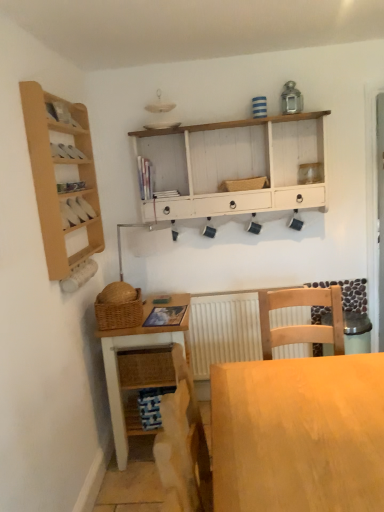
Question: Is wooden cabinet at left outside of light wood desk at center?

Choices:
 (A) no
 (B) yes

Answer: (B)

Question: Is wooden cabinet at left smaller than light wood desk at center?

Choices:
 (A) no
 (B) yes

Answer: (B)

Question: From a real-world perspective, is wooden cabinet at left positioned under light wood desk at center based on gravity?

Choices:
 (A) yes
 (B) no

Answer: (B)

Question: Considering the relative positions of wooden cabinet at left and light wood desk at center in the image provided, is wooden cabinet at left behind light wood desk at center?

Choices:
 (A) no
 (B) yes

Answer: (B)

Question: Does wooden cabinet at left have a lesser height compared to light wood desk at center?

Choices:
 (A) yes
 (B) no

Answer: (A)

Question: Is wooden cabinet at left in contact with light wood desk at center?

Choices:
 (A) no
 (B) yes

Answer: (A)

Question: From a real-world perspective, is light wood desk at center positioned over wooden cabinet at left based on gravity?

Choices:
 (A) no
 (B) yes

Answer: (A)

Question: Is light wood desk at center not inside wooden cabinet at left?

Choices:
 (A) no
 (B) yes

Answer: (B)

Question: Is light wood desk at center not near wooden cabinet at left?

Choices:
 (A) yes
 (B) no

Answer: (A)

Question: From a real-world perspective, is light wood desk at center beneath wooden cabinet at left?

Choices:
 (A) yes
 (B) no

Answer: (A)

Question: Considering the relative sizes of light wood desk at center and wooden cabinet at left in the image provided, is light wood desk at center thinner than wooden cabinet at left?

Choices:
 (A) yes
 (B) no

Answer: (B)

Question: From the image's perspective, is light wood desk at center above wooden cabinet at left?

Choices:
 (A) no
 (B) yes

Answer: (A)

Question: Is white textured radiator at center not inside white painted wood cabinet at upper center?

Choices:
 (A) yes
 (B) no

Answer: (A)